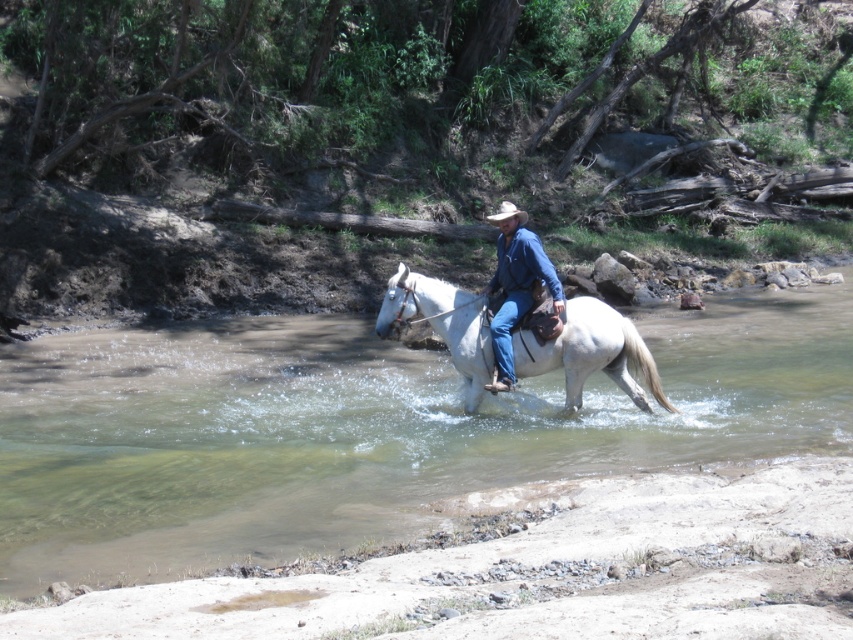
Based on the photo, you are a photographer trying to capture the rider and the horse in the river. Since you want to emphasize the horse, which object should you focus on first, the white glossy horse at center or the light brown felt cowboy hat at center?

The white glossy horse at center has a smaller size compared to the light brown felt cowboy hat at center, so you should focus on the white glossy horse at center first to ensure it is in sharp focus and properly framed.

You are a photographer capturing the scene of a rider on a horse crossing a river. You notice the white glossy horse at center and the blue denim jeans at center. Which object is positioned higher in the image?

The white glossy horse at center is located above the blue denim jeans at center, so it is positioned higher in the image.